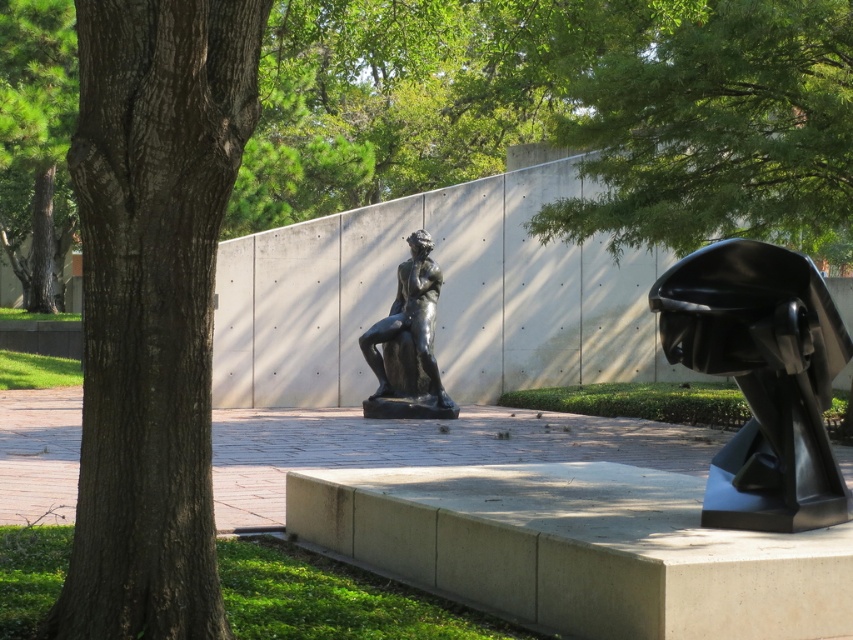
Does green leafy tree at left have a smaller size compared to bronze statue at center?

No.

Is point (38, 42) positioned in front of point (379, 323)?

No.

Who is more distant from viewer, (28, 248) or (393, 387)?

Point (28, 248)

You are a GUI agent. You are given a task and a screenshot of the screen. Output one action in this format:
    pyautogui.click(x=<x>, y=<y>)
    Task: Click on the green leafy tree at left
    
    Given the screenshot: What is the action you would take?
    pyautogui.click(x=38, y=145)

Can you confirm if brown rough bark tree at left is wider than black glossy sculpture at right?

No, brown rough bark tree at left is not wider than black glossy sculpture at right.

Can you confirm if brown rough bark tree at left is thinner than black glossy sculpture at right?

Yes, brown rough bark tree at left is thinner than black glossy sculpture at right.

Who is more forward, [164,620] or [674,355]?

Positioned in front is point [164,620].

At what (x,y) coordinates should I click in order to perform the action: click on brown rough bark tree at left. Please return your answer as a coordinate pair (x, y). Looking at the image, I should click on (152, 305).

What are the coordinates of `brown rough bark tree at left` in the screenshot? It's located at (152, 305).

Can you confirm if brown rough bark tree at left is positioned below green leafy tree at left?

Indeed, brown rough bark tree at left is positioned under green leafy tree at left.

Identify the location of brown rough bark tree at left. (152, 305).